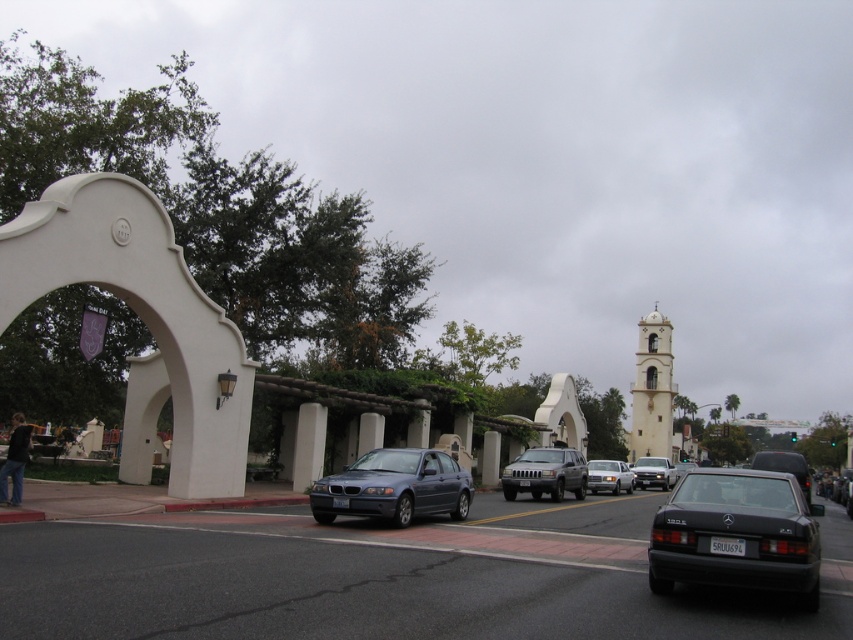
Question: Does black matte sedan at lower right have a larger size compared to light beige stucco bell tower at center-right?

Choices:
 (A) no
 (B) yes

Answer: (A)

Question: Which object appears closest to the camera in this image?

Choices:
 (A) shiny black sedan at center
 (B) satin blue sedan at center
 (C) black glossy sedan at center

Answer: (A)

Question: Which point is closer to the camera?

Choices:
 (A) shiny black sedan at center
 (B) black glossy sedan at center
 (C) matte silver sedan at center

Answer: (A)

Question: Can you confirm if matte silver suv at center is wider than matte silver sedan at center?

Choices:
 (A) yes
 (B) no

Answer: (B)

Question: Is white concrete pillar at center further to camera compared to shiny black sedan at center?

Choices:
 (A) yes
 (B) no

Answer: (A)

Question: Among these objects, which one is farthest from the camera?

Choices:
 (A) white concrete pillar at center
 (B) matte silver sedan at center
 (C) silver metallic sedan at center
 (D) light beige stucco bell tower at center-right

Answer: (D)